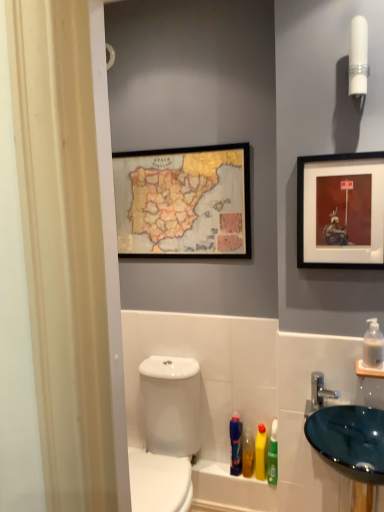
Locate an element on the screen. vacant space in front of silver metallic faucet at lower right is located at coordinates (x=344, y=426).